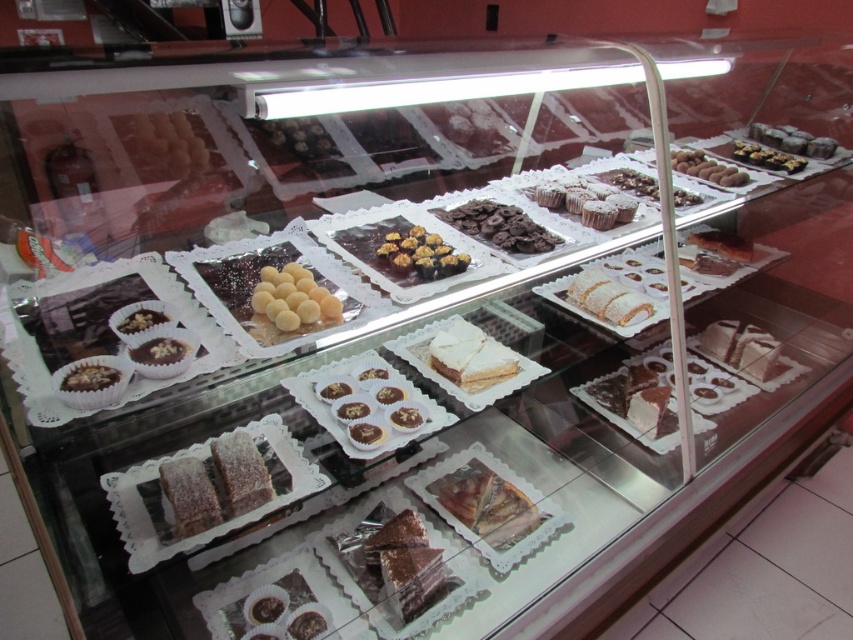
Question: Which point is closer to the camera?

Choices:
 (A) (206, 472)
 (B) (735, 150)
 (C) (498, 538)

Answer: (A)

Question: Can you confirm if chocolate matte cookie at center is positioned above matte chocolate cupcake at lower left?

Choices:
 (A) yes
 (B) no

Answer: (A)

Question: Which point appears farthest from the camera in this image?

Choices:
 (A) (224, 488)
 (B) (86, 381)
 (C) (582, 292)
 (D) (170, 480)

Answer: (C)

Question: Can you confirm if chocolate-coated nuts at center is positioned to the right of powdered white cake at center?

Choices:
 (A) no
 (B) yes

Answer: (A)

Question: Is glazed sugar-coated pastry at center to the left of chocolate-coated nuts at center from the viewer's perspective?

Choices:
 (A) yes
 (B) no

Answer: (A)

Question: Estimate the real-world distances between objects in this image. Which object is farther from the matte chocolate cupcake at lower left?

Choices:
 (A) chocolate matte cookie at center
 (B) white creamy cake at center
 (C) chocolate-coated nuts at center
 (D) chocolate cake at center

Answer: (A)